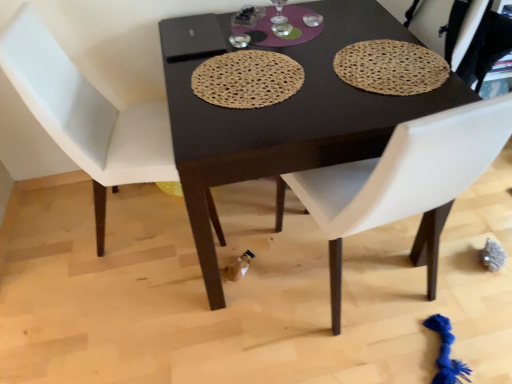
Question: Does white leather chair at left, arranged as the 1th chair when viewed from the left, have a smaller size compared to natural fiber placemat at center, the 1th mat when ordered from left to right?

Choices:
 (A) no
 (B) yes

Answer: (A)

Question: Is white leather chair at left, arranged as the 1th chair when viewed from the left, at the right side of natural fiber placemat at center, which appears as the second mat when viewed from the right?

Choices:
 (A) yes
 (B) no

Answer: (B)

Question: Are white leather chair at left, the 2th chair positioned from the right, and natural fiber placemat at center, which appears as the second mat when viewed from the right, located far from each other?

Choices:
 (A) no
 (B) yes

Answer: (A)

Question: Could natural fiber placemat at center, the 1th mat when ordered from left to right, be considered to be inside white leather chair at left, arranged as the 1th chair when viewed from the left?

Choices:
 (A) no
 (B) yes

Answer: (A)

Question: Is white leather chair at left, the 2th chair positioned from the right, wider than natural fiber placemat at center, which appears as the second mat when viewed from the right?

Choices:
 (A) no
 (B) yes

Answer: (B)

Question: Visually, is white leather chair at center, the 1th chair in the right-to-left sequence, positioned to the left or to the right of natural fiber placemat at center, which appears as the second mat when viewed from the right?

Choices:
 (A) left
 (B) right

Answer: (B)

Question: Is white leather chair at center, positioned as the second chair in left-to-right order, wider or thinner than natural fiber placemat at center, which appears as the second mat when viewed from the right?

Choices:
 (A) thin
 (B) wide

Answer: (B)

Question: From a real-world perspective, is white leather chair at center, positioned as the second chair in left-to-right order, physically located above or below natural fiber placemat at center, which appears as the second mat when viewed from the right?

Choices:
 (A) below
 (B) above

Answer: (A)

Question: From the image's perspective, is white leather chair at center, the 1th chair in the right-to-left sequence, positioned above or below natural fiber placemat at center, the 1th mat when ordered from left to right?

Choices:
 (A) above
 (B) below

Answer: (B)

Question: From a real-world perspective, is white leather chair at left, arranged as the 1th chair when viewed from the left, above or below white leather chair at center, the 1th chair in the right-to-left sequence?

Choices:
 (A) above
 (B) below

Answer: (A)

Question: In terms of size, does white leather chair at left, the 2th chair positioned from the right, appear bigger or smaller than white leather chair at center, positioned as the second chair in left-to-right order?

Choices:
 (A) small
 (B) big

Answer: (A)

Question: Considering the positions of white leather chair at left, the 2th chair positioned from the right, and white leather chair at center, the 1th chair in the right-to-left sequence, in the image, is white leather chair at left, the 2th chair positioned from the right, wider or thinner than white leather chair at center, the 1th chair in the right-to-left sequence,?

Choices:
 (A) wide
 (B) thin

Answer: (B)

Question: Which is correct: white leather chair at left, the 2th chair positioned from the right, is inside white leather chair at center, positioned as the second chair in left-to-right order, or outside of it?

Choices:
 (A) outside
 (B) inside

Answer: (A)

Question: Is point (94, 87) positioned closer to the camera than point (343, 49)?

Choices:
 (A) farther
 (B) closer

Answer: (A)

Question: From a real-world perspective, is white leather chair at left, arranged as the 1th chair when viewed from the left, positioned above or below brown woven placemat at upper right, the second mat viewed from the left?

Choices:
 (A) above
 (B) below

Answer: (B)